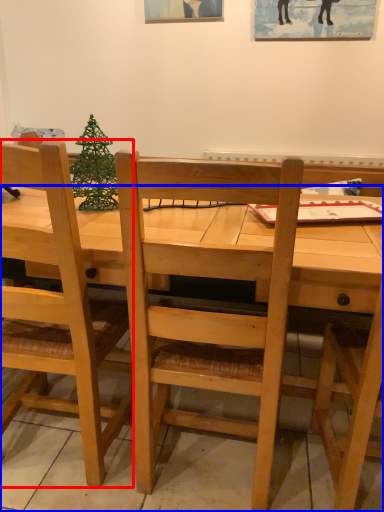
Question: Which object appears closest to the camera in this image, chair (highlighted by a red box) or desk (highlighted by a blue box)?

Choices:
 (A) chair
 (B) desk

Answer: (A)